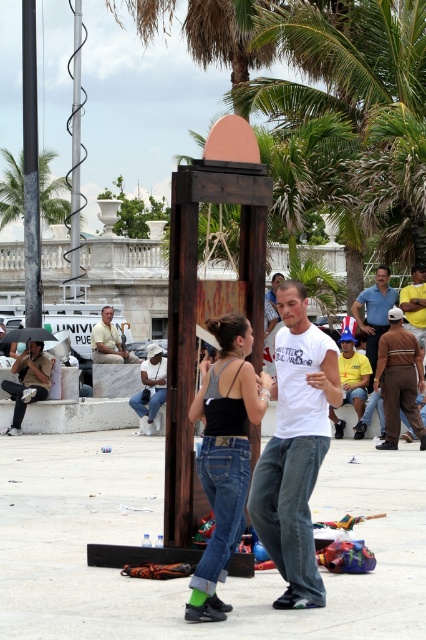
You are a photographer trying to capture the scene in the plaza. You notice two pairs of denim jeans at center and denim jeans at lower left. Which pair is positioned to the right side of the other?

The denim jeans at center is positioned to the right of denim jeans at lower left.

You are a tailor trying to determine which pair of jeans can accommodate a wider waistband. Given the scene described, which pair of jeans between the blue denim jeans at center and the dark blue jeans at lower left would you recommend?

The blue denim jeans at center has a greater width than the dark blue jeans at lower left, so it can accommodate a wider waistband.